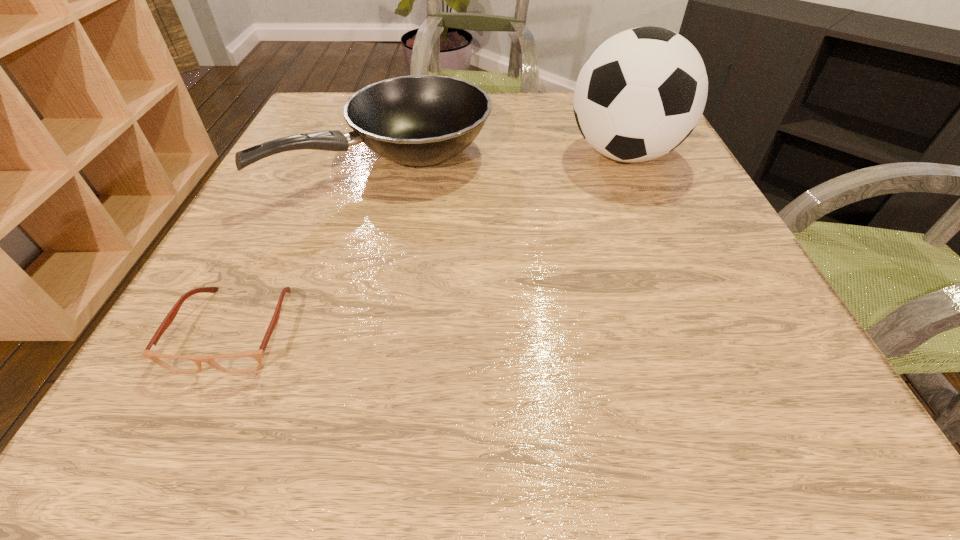
Identify the location of the rightmost object. The width and height of the screenshot is (960, 540). (641, 93).

Locate an element on the screen. This screenshot has width=960, height=540. the tallest object is located at coordinates (641, 93).

Locate an element on the screen. This screenshot has width=960, height=540. the second shortest object is located at coordinates (419, 120).

Image resolution: width=960 pixels, height=540 pixels. I want to click on spectacles, so [248, 361].

Locate an element on the screen. The image size is (960, 540). the shortest object is located at coordinates (248, 361).

Find the location of a particular element. vacant space located 0.100m on the left of the soccer ball is located at coordinates (519, 154).

Locate an element on the screen. The height and width of the screenshot is (540, 960). vacant space located on the front of the frying pan is located at coordinates (325, 379).

This screenshot has height=540, width=960. What are the coordinates of `free space located on the front-facing side of the nearest object` in the screenshot? It's located at (187, 431).

This screenshot has width=960, height=540. In order to click on soccer ball that is at the far edge in this screenshot , I will do `click(641, 93)`.

Locate an element on the screen. This screenshot has height=540, width=960. frying pan situated at the far edge is located at coordinates (419, 120).